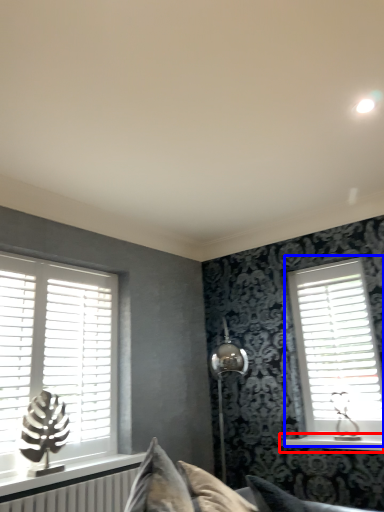
Question: Which of the following is the farthest to the observer, window sill (highlighted by a red box) or window (highlighted by a blue box)?

Choices:
 (A) window sill
 (B) window

Answer: (B)